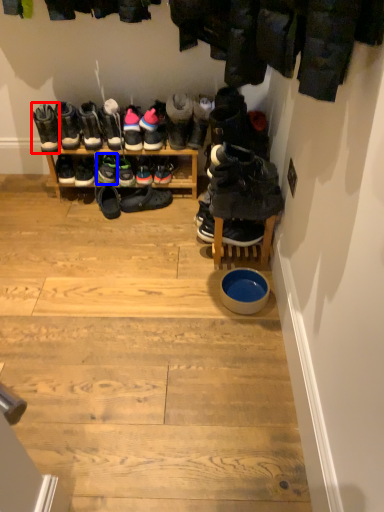
Question: Which of the following is the closest to the observer, footwear (highlighted by a red box) or footwear (highlighted by a blue box)?

Choices:
 (A) footwear
 (B) footwear

Answer: (A)